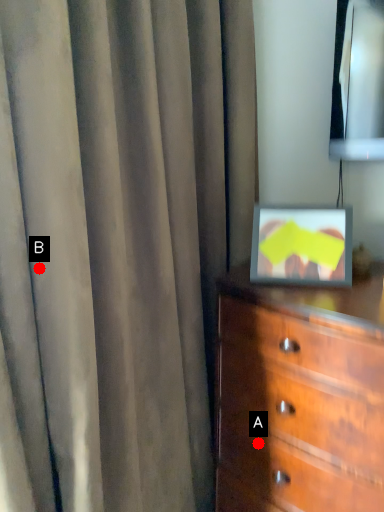
Question: Two points are circled on the image, labeled by A and B beside each circle. Which point is closer to the camera?

Choices:
 (A) A is closer
 (B) B is closer

Answer: (B)